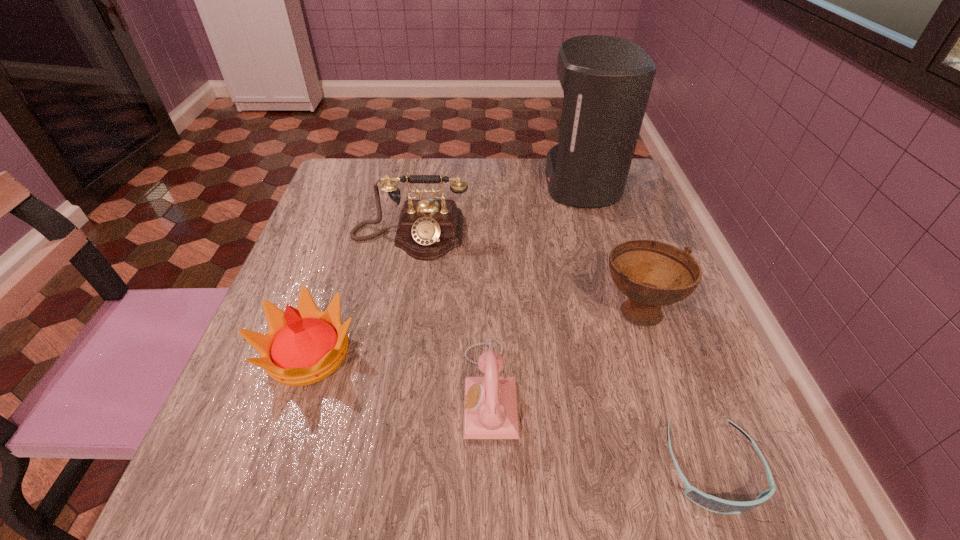
Find the location of `vacant point at the right edge`. vacant point at the right edge is located at coordinates (706, 342).

In the image, there is a desktop. At what (x,y) coordinates should I click in order to perform the action: click on vacant space at the far left corner. Please return your answer as a coordinate pair (x, y). The height and width of the screenshot is (540, 960). Looking at the image, I should click on (339, 186).

Find the location of a particular element. free space between the crown and the nearer telephone is located at coordinates (399, 372).

The image size is (960, 540). I want to click on empty space that is in between the fifth nearest object and the crown, so click(359, 295).

You are a GUI agent. You are given a task and a screenshot of the screen. Output one action in this format:
    pyautogui.click(x=<x>, y=<y>)
    Task: Click on the empty space that is in between the goggles and the second farthest object
    This screenshot has height=540, width=960.
    Given the screenshot: What is the action you would take?
    pyautogui.click(x=561, y=352)

Where is `free space between the shortest object and the soup bowl`? The height and width of the screenshot is (540, 960). free space between the shortest object and the soup bowl is located at coordinates (675, 389).

You are a GUI agent. You are given a task and a screenshot of the screen. Output one action in this format:
    pyautogui.click(x=<x>, y=<y>)
    Task: Click on the unoccupied position between the shorter telephone and the soup bowl
    
    Given the screenshot: What is the action you would take?
    pyautogui.click(x=564, y=349)

At what (x,y) coordinates should I click in order to perform the action: click on vacant area that lies between the farther telephone and the farthest object. Please return your answer as a coordinate pair (x, y). The height and width of the screenshot is (540, 960). Looking at the image, I should click on (495, 209).

Where is `unoccupied area between the shorter telephone and the crown`? unoccupied area between the shorter telephone and the crown is located at coordinates (399, 372).

In order to click on unoccupied area between the farthest object and the crown in this screenshot , I will do [x=444, y=268].